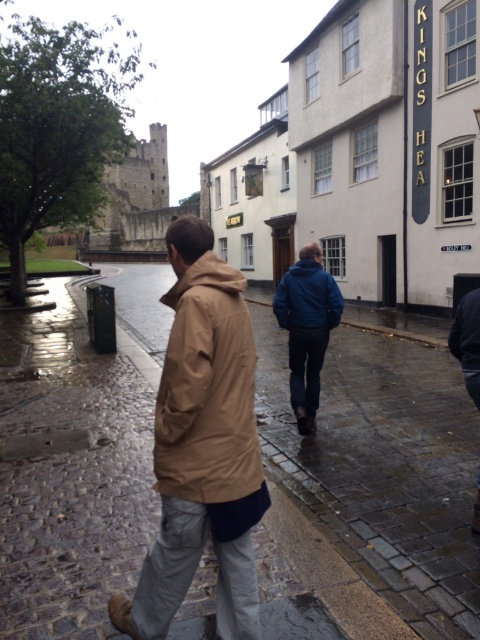
You are a tourist in this historic town and see two jackets on the cobblestone street. The tan matte jacket at center and the dark blue jacket at lower right. Which jacket is bigger?

The dark blue jacket at lower right is bigger than the tan matte jacket at center.

You are a fashion designer observing two coats on a mannequin in the middle of a historic town street. The coats are the tan fabric trench coat at center and the tan matte jacket at center. Which coat has a larger size?

The tan fabric trench coat at center is bigger than the tan matte jacket at center, so the tan fabric trench coat at center has a larger size.